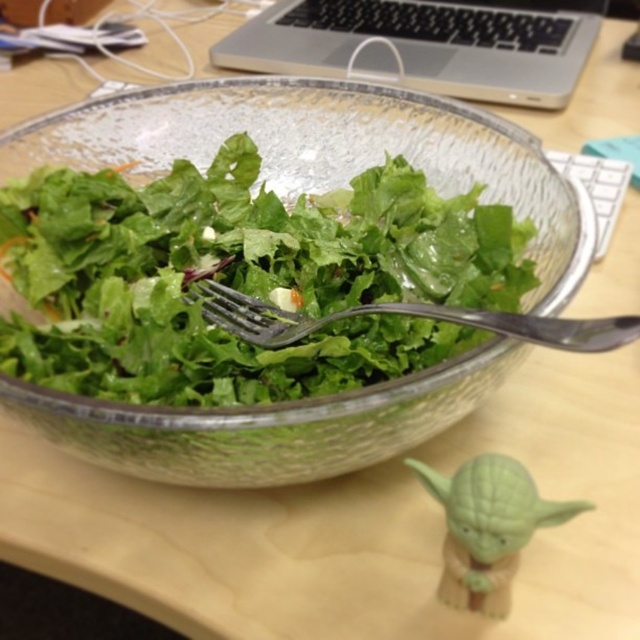
Question: Which point appears closest to the camera in this image?

Choices:
 (A) (221, 298)
 (B) (148, 204)
 (C) (280, 13)

Answer: (A)

Question: Considering the real-world distances, which object is closest to the green leafy salad at center?

Choices:
 (A) silver metallic laptop at upper center
 (B) satin silver fork at center

Answer: (B)

Question: Does silver metallic laptop at upper center have a smaller size compared to satin silver fork at center?

Choices:
 (A) yes
 (B) no

Answer: (B)

Question: Where is green leafy salad at center located in relation to satin silver fork at center in the image?

Choices:
 (A) left
 (B) right

Answer: (A)

Question: Can you confirm if green leafy salad at center is smaller than silver metallic laptop at upper center?

Choices:
 (A) no
 (B) yes

Answer: (B)

Question: Among these points, which one is nearest to the camera?

Choices:
 (A) [273, 285]
 (B) [572, 22]

Answer: (A)